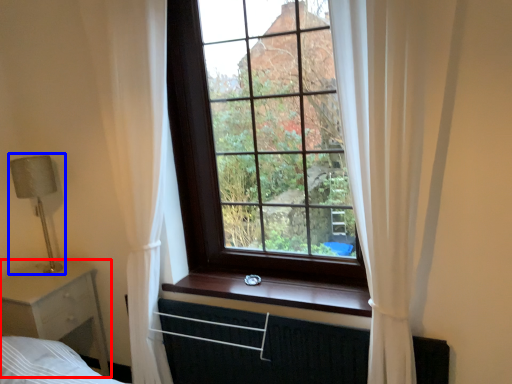
Question: Which object appears farthest to the camera in this image, nightstand (highlighted by a red box) or table lamp (highlighted by a blue box)?

Choices:
 (A) nightstand
 (B) table lamp

Answer: (B)